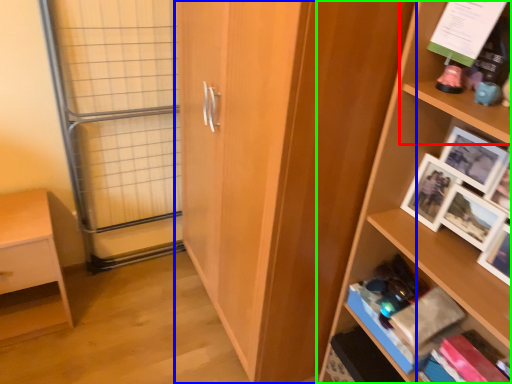
Question: Which object is the closest to the shelf (highlighted by a red box)? Choose among these: cupboard (highlighted by a blue box) or shelf (highlighted by a green box).

Choices:
 (A) cupboard
 (B) shelf

Answer: (B)